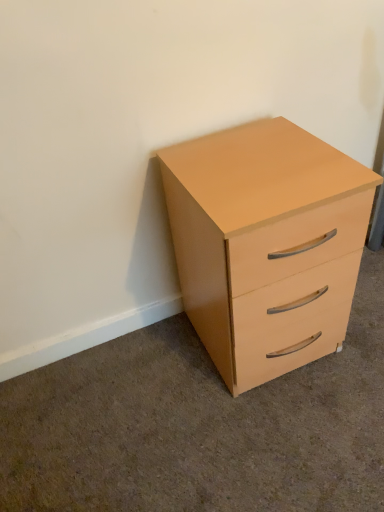
Locate an element on the screen. This screenshot has width=384, height=512. vacant region to the left of matte wood chest of drawers at lower right is located at coordinates (150, 378).